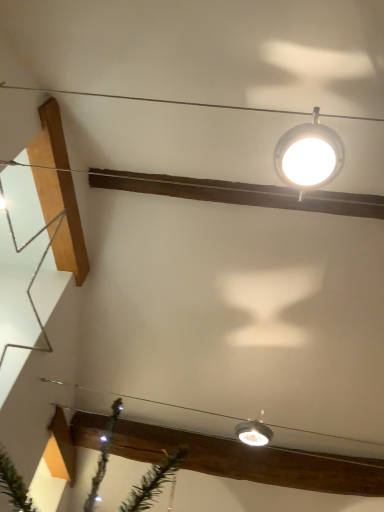
What do you see at coordinates (48, 212) in the screenshot? Image resolution: width=384 pixels, height=512 pixels. I see `metallic silver star at left` at bounding box center [48, 212].

Identify the location of white glossy lamp at upper center, acting as the 2th lamp starting from the bottom. The height and width of the screenshot is (512, 384). (309, 155).

Describe the element at coordinates (182, 407) in the screenshot. I see `clear plastic wire at lower center` at that location.

Measure the distance between point (295, 429) and camera.

Point (295, 429) and camera are 7.04 feet apart.

Find the location of a particular element. Image resolution: width=384 pixels, height=512 pixels. metallic silver star at left is located at coordinates (48, 212).

Between white glossy lamp at upper center, positioned as the 1th lamp in top-to-bottom order, and matte silver lamp at lower center, marked as the second lamp in a top-to-bottom arrangement, which one has smaller size?

With smaller size is matte silver lamp at lower center, marked as the second lamp in a top-to-bottom arrangement.

From a real-world perspective, is white glossy lamp at upper center, acting as the 2th lamp starting from the bottom, above or below matte silver lamp at lower center, which is the 1th lamp in back-to-front order?

Clearly, from a real-world perspective, white glossy lamp at upper center, acting as the 2th lamp starting from the bottom, is above matte silver lamp at lower center, which is the 1th lamp in back-to-front order.

Measure the distance from white glossy lamp at upper center, positioned as the 1th lamp in top-to-bottom order, to matte silver lamp at lower center, which ranks as the second lamp in front-to-back order.

They are 3.57 feet apart.

Could you tell me if white glossy lamp at upper center, acting as the 2th lamp starting from the bottom, is turned towards matte silver lamp at lower center, which ranks as the second lamp in front-to-back order?

No, white glossy lamp at upper center, acting as the 2th lamp starting from the bottom, is not oriented towards matte silver lamp at lower center, which ranks as the second lamp in front-to-back order.

How distant is metallic silver star at left from clear plastic wire at lower center?

They are 31.85 inches apart.

From the image's perspective, which is above, metallic silver star at left or clear plastic wire at lower center?

metallic silver star at left, from the image's perspective.

Can you confirm if metallic silver star at left is smaller than clear plastic wire at lower center?

Actually, metallic silver star at left might be larger than clear plastic wire at lower center.

The image size is (384, 512). What are the coordinates of `stairwell that is in front of the clear plastic wire at lower center` in the screenshot? It's located at pyautogui.click(x=48, y=212).

Is there a large distance between white glossy lamp at upper center, the second lamp in the back-to-front sequence, and clear plastic wire at lower center?

Absolutely, white glossy lamp at upper center, the second lamp in the back-to-front sequence, is distant from clear plastic wire at lower center.

In the image, is white glossy lamp at upper center, positioned as the 1th lamp in front-to-back order, on the left side or the right side of clear plastic wire at lower center?

white glossy lamp at upper center, positioned as the 1th lamp in front-to-back order, is to the right of clear plastic wire at lower center.

Would you say matte silver lamp at lower center, which ranks as the second lamp in front-to-back order, is outside metallic silver star at left?

Absolutely, matte silver lamp at lower center, which ranks as the second lamp in front-to-back order, is external to metallic silver star at left.

Does matte silver lamp at lower center, marked as the second lamp in a top-to-bottom arrangement, appear on the left side of metallic silver star at left?

No.

Find the location of a particular element. Image resolution: width=384 pixels, height=512 pixels. lamp that is the 2nd one below the metallic silver star at left (from a real-world perspective) is located at coordinates (254, 432).

Measure the distance from matte silver lamp at lower center, which is the 1th lamp in back-to-front order, to metallic silver star at left.

matte silver lamp at lower center, which is the 1th lamp in back-to-front order, and metallic silver star at left are 3.70 feet apart from each other.

Is metallic silver star at left not near white glossy lamp at upper center, acting as the 2th lamp starting from the bottom?

Result: Yes, metallic silver star at left and white glossy lamp at upper center, acting as the 2th lamp starting from the bottom, are located far from each other.

How much distance is there between metallic silver star at left and white glossy lamp at upper center, acting as the 2th lamp starting from the bottom?

metallic silver star at left is 3.59 feet away from white glossy lamp at upper center, acting as the 2th lamp starting from the bottom.

Is point (25, 168) closer to viewer compared to point (318, 168)?

No, (25, 168) is further to viewer.

Is metallic silver star at left spatially inside white glossy lamp at upper center, positioned as the 1th lamp in front-to-back order, or outside of it?

metallic silver star at left is located beyond the bounds of white glossy lamp at upper center, positioned as the 1th lamp in front-to-back order.

Between clear plastic wire at lower center and matte silver lamp at lower center, which ranks as the 1th lamp in bottom-to-top order, which one appears on the left side from the viewer's perspective?

From the viewer's perspective, clear plastic wire at lower center appears more on the left side.

Could you tell me if clear plastic wire at lower center is turned towards matte silver lamp at lower center, marked as the second lamp in a top-to-bottom arrangement?

Yes, clear plastic wire at lower center faces towards matte silver lamp at lower center, marked as the second lamp in a top-to-bottom arrangement.

Can you confirm if clear plastic wire at lower center is thinner than matte silver lamp at lower center, marked as the second lamp in a top-to-bottom arrangement?

Incorrect, the width of clear plastic wire at lower center is not less than that of matte silver lamp at lower center, marked as the second lamp in a top-to-bottom arrangement.

Looking at the image, does white glossy lamp at upper center, positioned as the 1th lamp in front-to-back order, seem bigger or smaller compared to metallic silver star at left?

white glossy lamp at upper center, positioned as the 1th lamp in front-to-back order, is smaller than metallic silver star at left.

From a real-world perspective, is white glossy lamp at upper center, positioned as the 1th lamp in front-to-back order, located beneath metallic silver star at left?

Correct, in the physical world, white glossy lamp at upper center, positioned as the 1th lamp in front-to-back order, is lower than metallic silver star at left.

In the scene shown: Could you tell me if white glossy lamp at upper center, the second lamp in the back-to-front sequence, is facing metallic silver star at left?

No, white glossy lamp at upper center, the second lamp in the back-to-front sequence, does not turn towards metallic silver star at left.

Which of these two, white glossy lamp at upper center, acting as the 2th lamp starting from the bottom, or metallic silver star at left, is wider?

With larger width is white glossy lamp at upper center, acting as the 2th lamp starting from the bottom.

You are a GUI agent. You are given a task and a screenshot of the screen. Output one action in this format:
    pyautogui.click(x=<x>, y=<y>)
    Task: Click on the lamp that is behind the white glossy lamp at upper center, acting as the 2th lamp starting from the bottom
    The width and height of the screenshot is (384, 512).
    Given the screenshot: What is the action you would take?
    pyautogui.click(x=254, y=432)

This screenshot has height=512, width=384. Find the location of `wire below the metallic silver star at left (from a real-world perspective)`. wire below the metallic silver star at left (from a real-world perspective) is located at coordinates (182, 407).

Estimate the real-world distances between objects in this image. Which object is further from white glossy lamp at upper center, the second lamp in the back-to-front sequence, clear plastic wire at lower center or matte silver lamp at lower center, which ranks as the second lamp in front-to-back order?

Among the two, clear plastic wire at lower center is located further to white glossy lamp at upper center, the second lamp in the back-to-front sequence.

Looking at the image, which one is located closer to clear plastic wire at lower center, matte silver lamp at lower center, marked as the second lamp in a top-to-bottom arrangement, or white glossy lamp at upper center, the second lamp in the back-to-front sequence?

matte silver lamp at lower center, marked as the second lamp in a top-to-bottom arrangement, is closer to clear plastic wire at lower center.

Looking at the image, which one is located closer to white glossy lamp at upper center, acting as the 2th lamp starting from the bottom, clear plastic wire at lower center or metallic silver star at left?

metallic silver star at left is positioned closer to the anchor white glossy lamp at upper center, acting as the 2th lamp starting from the bottom.

Considering their positions, is metallic silver star at left positioned further to clear plastic wire at lower center than white glossy lamp at upper center, positioned as the 1th lamp in top-to-bottom order?

Answer: white glossy lamp at upper center, positioned as the 1th lamp in top-to-bottom order, is further to clear plastic wire at lower center.

Looking at the image, which one is located further to clear plastic wire at lower center, white glossy lamp at upper center, positioned as the 1th lamp in top-to-bottom order, or metallic silver star at left?

white glossy lamp at upper center, positioned as the 1th lamp in top-to-bottom order, is positioned further to the anchor clear plastic wire at lower center.

Which object lies further to the anchor point clear plastic wire at lower center, metallic silver star at left or matte silver lamp at lower center, which ranks as the 1th lamp in bottom-to-top order?

Based on the image, metallic silver star at left appears to be further to clear plastic wire at lower center.

Based on their spatial positions, is white glossy lamp at upper center, acting as the 2th lamp starting from the bottom, or matte silver lamp at lower center, which ranks as the 1th lamp in bottom-to-top order, closer to clear plastic wire at lower center?

matte silver lamp at lower center, which ranks as the 1th lamp in bottom-to-top order, is closer to clear plastic wire at lower center.

Looking at the image, which one is located further to white glossy lamp at upper center, the second lamp in the back-to-front sequence, metallic silver star at left or matte silver lamp at lower center, marked as the second lamp in a top-to-bottom arrangement?

The object further to white glossy lamp at upper center, the second lamp in the back-to-front sequence, is metallic silver star at left.

Locate an element on the screen. lamp located between metallic silver star at left and white glossy lamp at upper center, positioned as the 1th lamp in front-to-back order, in the left-right direction is located at coordinates (254, 432).

You are a GUI agent. You are given a task and a screenshot of the screen. Output one action in this format:
    pyautogui.click(x=<x>, y=<y>)
    Task: Click on the wire between white glossy lamp at upper center, acting as the 2th lamp starting from the bottom, and matte silver lamp at lower center, which is the 1th lamp in back-to-front order, in the vertical direction
    This screenshot has width=384, height=512.
    Given the screenshot: What is the action you would take?
    (x=182, y=407)

Where is `stairwell between white glossy lamp at upper center, positioned as the 1th lamp in top-to-bottom order, and clear plastic wire at lower center in the up-down direction`? This screenshot has height=512, width=384. stairwell between white glossy lamp at upper center, positioned as the 1th lamp in top-to-bottom order, and clear plastic wire at lower center in the up-down direction is located at coordinates (48, 212).

This screenshot has width=384, height=512. Identify the location of wire between metallic silver star at left and matte silver lamp at lower center, marked as the second lamp in a top-to-bottom arrangement, in the horizontal direction. (182, 407).